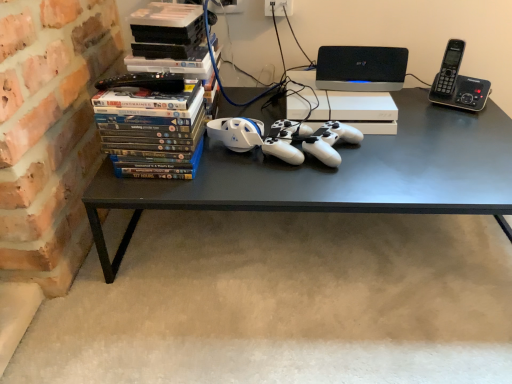
You are a GUI agent. You are given a task and a screenshot of the screen. Output one action in this format:
    pyautogui.click(x=<x>, y=<y>)
    Task: Click on the free area below black matte desk at center (from a real-world perspective)
    
    Given the screenshot: What is the action you would take?
    pyautogui.click(x=326, y=235)